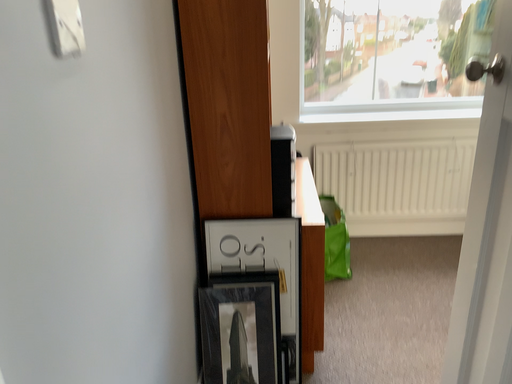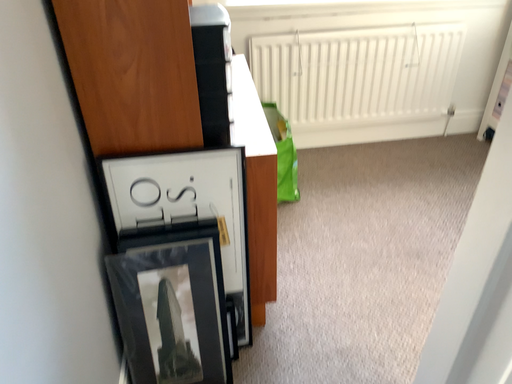
Question: Which way did the camera rotate in the video?

Choices:
 (A) rotated right
 (B) rotated left

Answer: (A)